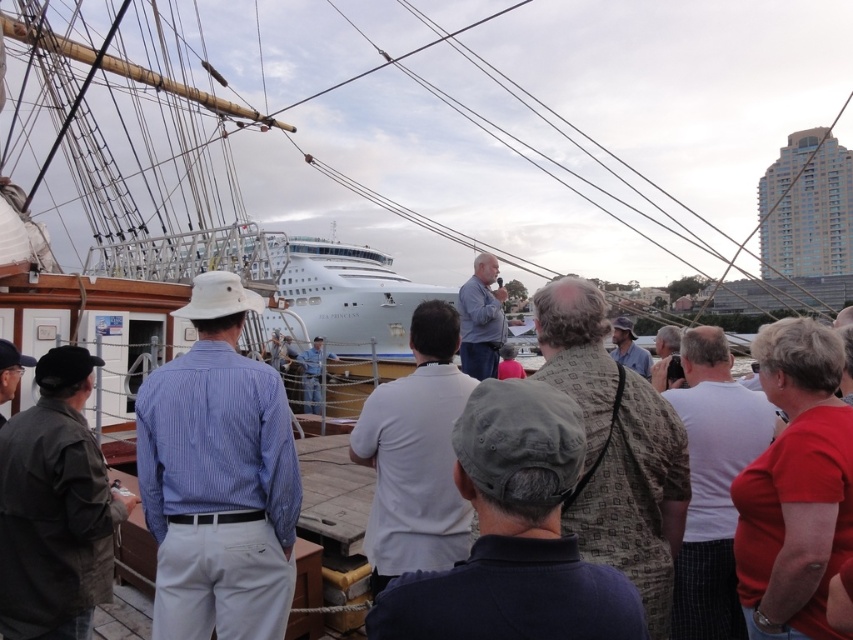
Question: Which object appears closest to the camera in this image?

Choices:
 (A) light brown leather jacket at center
 (B) camouflage-patterned shirt at center
 (C) red matte shirt at lower right
 (D) blue shirt at center

Answer: (C)

Question: Observing the image, what is the correct spatial positioning of blue striped shirt at center in reference to light blue uniform at center?

Choices:
 (A) right
 (B) left

Answer: (A)

Question: Can you confirm if camouflage-patterned shirt at center is positioned to the right of light blue uniform at center?

Choices:
 (A) no
 (B) yes

Answer: (B)

Question: Is dark gray fabric jacket at lower left in front of light blue uniform at center?

Choices:
 (A) yes
 (B) no

Answer: (A)

Question: Among these objects, which one is nearest to the camera?

Choices:
 (A) blue shirt at center
 (B) light brown leather jacket at center

Answer: (B)

Question: Estimate the real-world distances between objects in this image. Which object is closer to the dark gray fabric jacket at lower left?

Choices:
 (A) light blue uniform at center
 (B) light brown leather jacket at center
 (C) red matte shirt at lower right
 (D) camouflage-patterned shirt at center

Answer: (A)